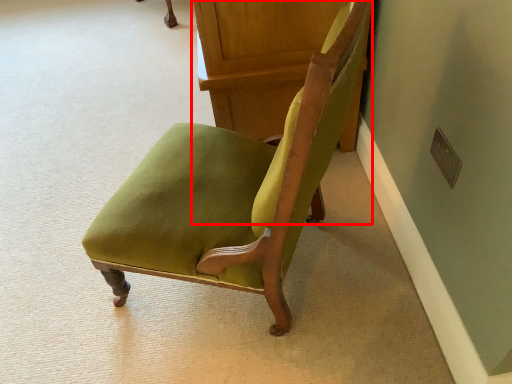
Question: From the image's perspective, where is furniture (annotated by the red box) located relative to chair?

Choices:
 (A) below
 (B) above

Answer: (B)